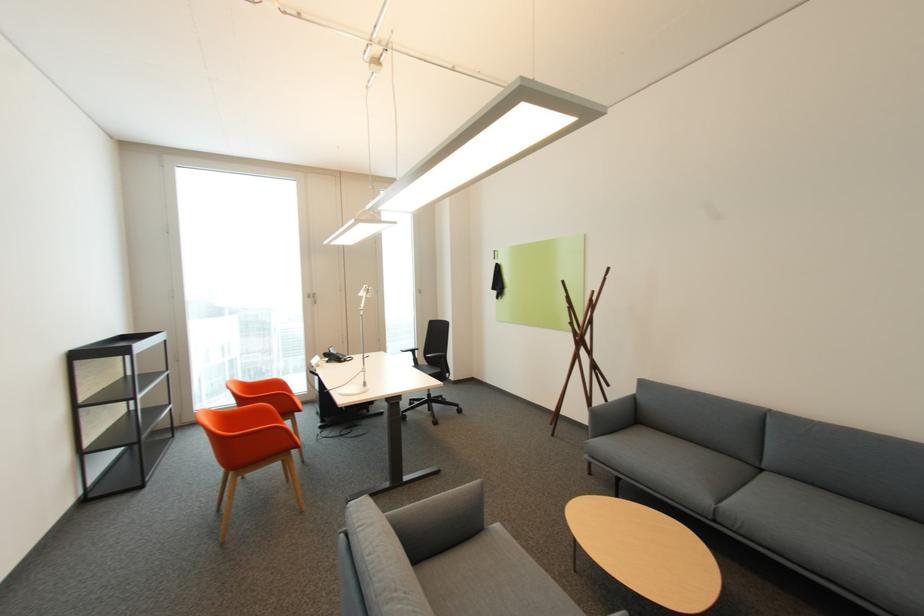
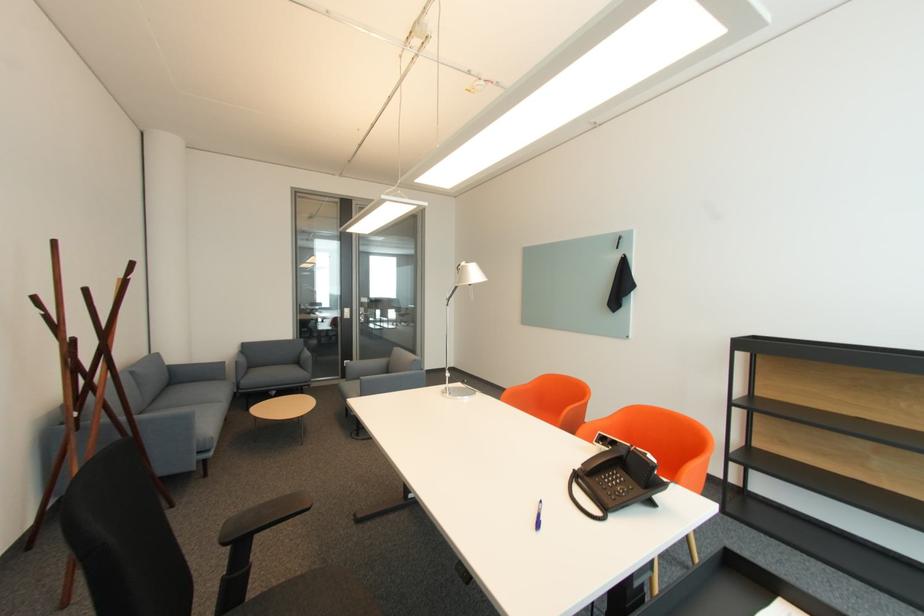
Locate, in the second image, the point that corresponds to point (769, 469) in the first image.

(151, 411)